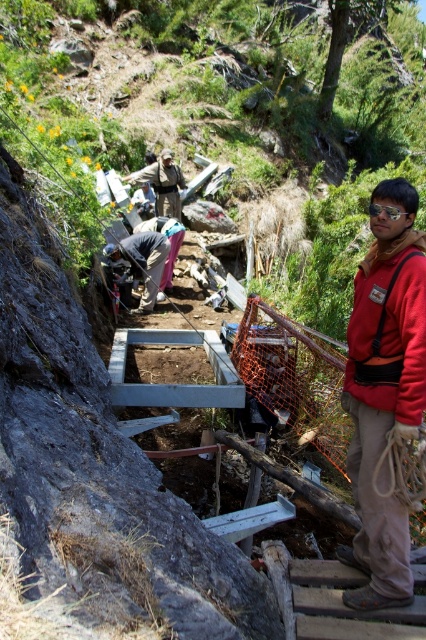
Is khaki pants at center thinner than dark gray fabric at center?

Correct, khaki pants at center's width is less than dark gray fabric at center's.

This screenshot has height=640, width=426. Describe the element at coordinates (385, 388) in the screenshot. I see `khaki pants at center` at that location.

The width and height of the screenshot is (426, 640). In order to click on khaki pants at center in this screenshot , I will do `click(385, 388)`.

In the scene shown: Who is shorter, red matte jacket at right or khaki uniform at center?

Standing shorter between the two is red matte jacket at right.

Can you confirm if red matte jacket at right is thinner than khaki uniform at center?

Yes.

Is point (368, 321) less distant than point (138, 179)?

Yes, point (368, 321) is in front of point (138, 179).

Identify the location of red matte jacket at right. Image resolution: width=426 pixels, height=640 pixels. (391, 326).

Is khaki pants at center taller than red matte jacket at right?

Correct, khaki pants at center is much taller as red matte jacket at right.

Can you confirm if khaki pants at center is positioned below red matte jacket at right?

Yes, khaki pants at center is below red matte jacket at right.

What do you see at coordinates (385, 388) in the screenshot? The width and height of the screenshot is (426, 640). I see `khaki pants at center` at bounding box center [385, 388].

Find the location of a particular element. The image size is (426, 640). khaki pants at center is located at coordinates (385, 388).